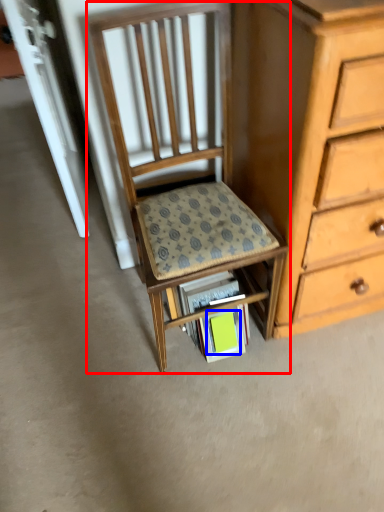
Question: Which object is further to the camera taking this photo, chair (highlighted by a red box) or paperback book (highlighted by a blue box)?

Choices:
 (A) chair
 (B) paperback book

Answer: (B)